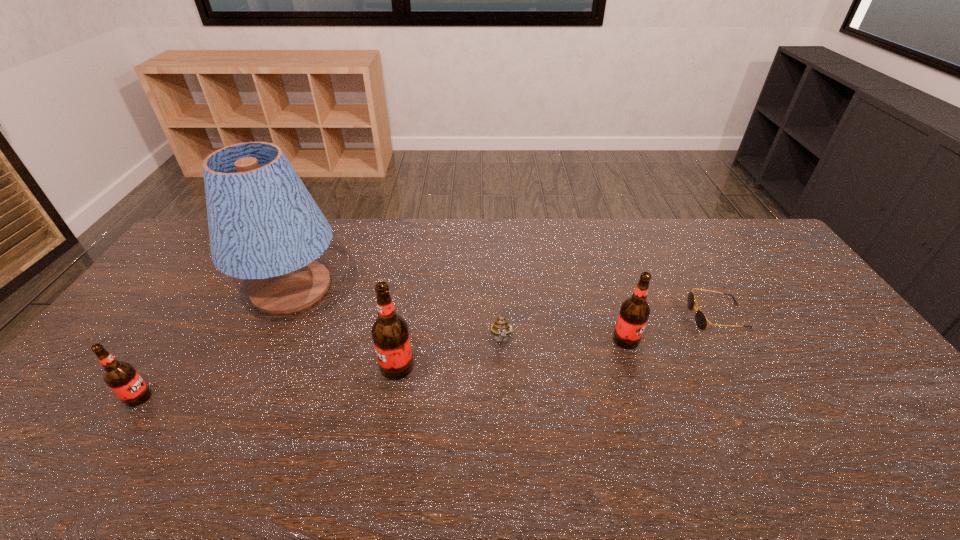
Image resolution: width=960 pixels, height=540 pixels. What are the coordinates of `object located in the far edge section of the desktop` in the screenshot? It's located at (264, 225).

Locate an element on the screen. object that is at the near edge is located at coordinates (121, 377).

You are a GUI agent. You are given a task and a screenshot of the screen. Output one action in this format:
    pyautogui.click(x=<x>, y=<y>)
    Task: Click on the free space at the far edge of the desktop
    
    Given the screenshot: What is the action you would take?
    pyautogui.click(x=700, y=237)

Identify the location of free spot at the near edge of the desktop. (255, 402).

The width and height of the screenshot is (960, 540). I want to click on vacant region at the left edge, so click(192, 284).

Locate an element on the screen. This screenshot has height=540, width=960. unoccupied area between the shortest object and the nearest object is located at coordinates (428, 357).

Locate an element on the screen. The image size is (960, 540). blank region between the tallest root beer and the rightmost object is located at coordinates (557, 342).

Identify the location of free area in between the third object from right to left and the sunglasses. The height and width of the screenshot is (540, 960). (610, 329).

This screenshot has height=540, width=960. In order to click on vacant space in between the sunglasses and the second tallest root beer in this screenshot , I will do `click(672, 328)`.

I want to click on empty space that is in between the second root beer from right to left and the shortest object, so click(x=557, y=342).